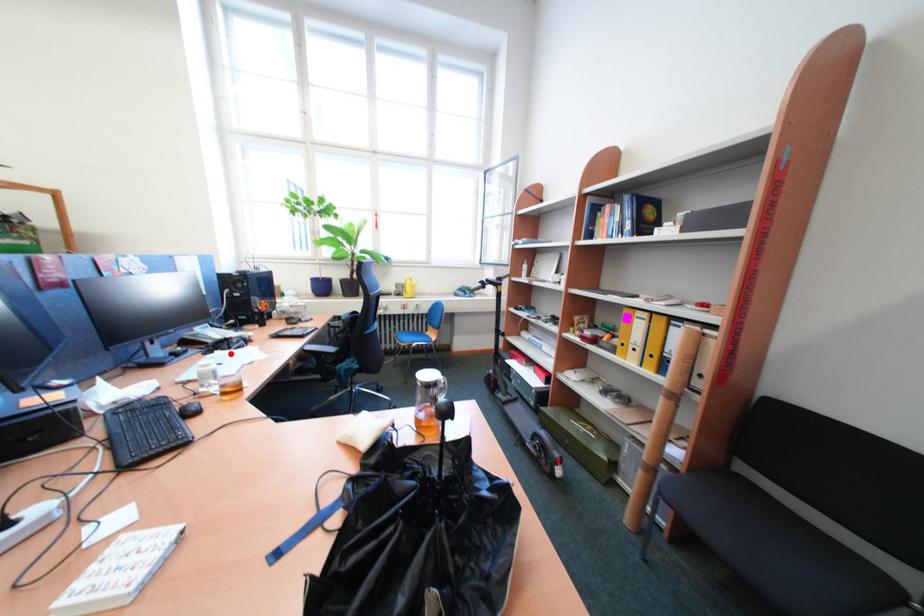
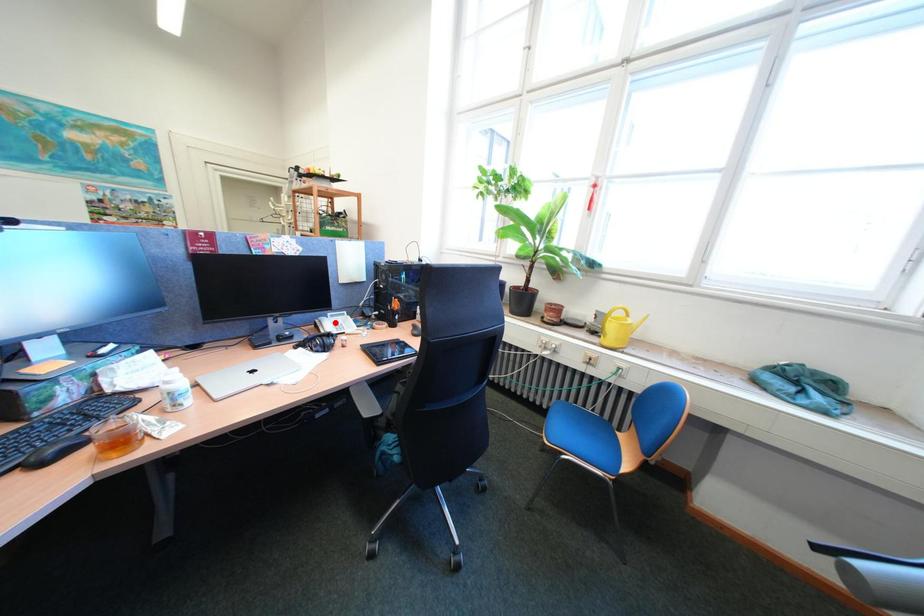
I am providing you with two images of the same scene from different viewpoints. A red point is marked on the first image and another point is marked on the second image. Do the highlighted points in image1 and image2 indicate the same real-world spot?

No